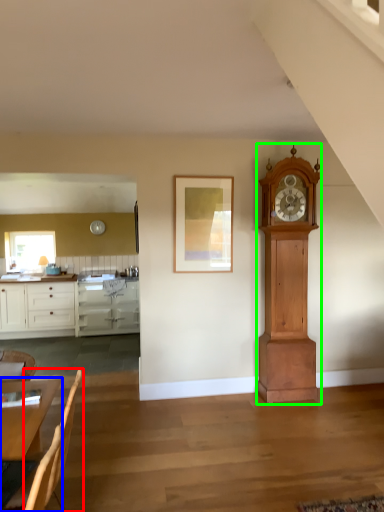
Question: Based on their relative distances, which object is nearer to armchair (highlighted by a red box)? Choose from table (highlighted by a blue box) and wall clock (highlighted by a green box).

Choices:
 (A) table
 (B) wall clock

Answer: (A)